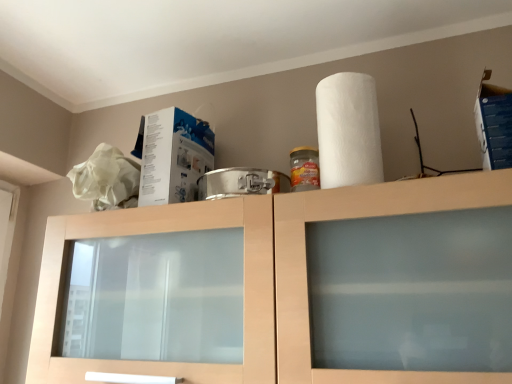
The image size is (512, 384). What do you see at coordinates (348, 131) in the screenshot?
I see `white textured paper towel at upper right` at bounding box center [348, 131].

Where is `matte wood cabinet at center`? This screenshot has width=512, height=384. matte wood cabinet at center is located at coordinates (256, 276).

Is matte wood cabinet at center in contact with white cardboard box at upper left, marked as the 2th box in a right-to-left arrangement?

No.

Can white cardboard box at upper left, the first box positioned from the back, be found inside matte wood cabinet at center?

Actually, white cardboard box at upper left, the first box positioned from the back, is outside matte wood cabinet at center.

Is point (44, 277) in front of point (183, 132)?

Yes, point (44, 277) is closer to viewer.

Does blue cardboard box at upper right, which is the 1th box from right to left, have a lesser width compared to matte wood cabinet at center?

Correct, the width of blue cardboard box at upper right, which is the 1th box from right to left, is less than that of matte wood cabinet at center.

Based on the photo, between blue cardboard box at upper right, acting as the 2th box starting from the left, and matte wood cabinet at center, which one appears on the right side from the viewer's perspective?

blue cardboard box at upper right, acting as the 2th box starting from the left, is more to the right.

From the image's perspective, is blue cardboard box at upper right, acting as the 2th box starting from the left, beneath matte wood cabinet at center?

Actually, blue cardboard box at upper right, acting as the 2th box starting from the left, appears above matte wood cabinet at center in the image.

From a real-world perspective, who is located lower, blue cardboard box at upper right, which is the first box from front to back, or matte wood cabinet at center?

matte wood cabinet at center, from a real-world perspective.

Is matte wood cabinet at center next to white textured paper towel at upper right and touching it?

No, matte wood cabinet at center is not beside white textured paper towel at upper right.

From the image's perspective, does matte wood cabinet at center appear higher than white textured paper towel at upper right?

No, from the image's perspective, matte wood cabinet at center is not over white textured paper towel at upper right.

From a real-world perspective, is matte wood cabinet at center located higher than white textured paper towel at upper right?

No.

Identify the location of paper towel on the right of matte wood cabinet at center. The image size is (512, 384). (348, 131).

Is white cardboard box at upper left, arranged as the 2th box when viewed from the front, thinner than blue cardboard box at upper right, which is the first box from front to back?

No, white cardboard box at upper left, arranged as the 2th box when viewed from the front, is not thinner than blue cardboard box at upper right, which is the first box from front to back.

In terms of height, does white cardboard box at upper left, the first box viewed from the left, look taller or shorter compared to blue cardboard box at upper right, the 2th box from the back?

In the image, white cardboard box at upper left, the first box viewed from the left, appears to be taller than blue cardboard box at upper right, the 2th box from the back.

Which is more to the right, white cardboard box at upper left, the first box positioned from the back, or blue cardboard box at upper right, the 2th box from the back?

blue cardboard box at upper right, the 2th box from the back, is more to the right.

Is point (165, 200) closer to viewer compared to point (475, 118)?

Yes, it is.

Is there a large distance between white cardboard box at upper left, marked as the 2th box in a right-to-left arrangement, and white textured paper towel at upper right?

They are positioned close to each other.

From a real-world perspective, who is located lower, white cardboard box at upper left, the first box positioned from the back, or white textured paper towel at upper right?

white cardboard box at upper left, the first box positioned from the back, from a real-world perspective.

Which is more to the left, white cardboard box at upper left, the first box positioned from the back, or white textured paper towel at upper right?

Positioned to the left is white cardboard box at upper left, the first box positioned from the back.

Considering the positions of objects white cardboard box at upper left, the first box viewed from the left, and white textured paper towel at upper right in the image provided, who is behind, white cardboard box at upper left, the first box viewed from the left, or white textured paper towel at upper right?

Positioned behind is white cardboard box at upper left, the first box viewed from the left.

From the image's perspective, is white textured paper towel at upper right located beneath white cardboard box at upper left, arranged as the 2th box when viewed from the front?

No, from the image's perspective, white textured paper towel at upper right is not below white cardboard box at upper left, arranged as the 2th box when viewed from the front.

Which is further, (369, 130) or (150, 143)?

The point (150, 143) is more distant.

Between white textured paper towel at upper right and white cardboard box at upper left, the first box viewed from the left, which one appears on the right side from the viewer's perspective?

white textured paper towel at upper right is more to the right.

Which is closer, (508, 127) or (148, 190)?

Clearly, point (508, 127) is closer to the camera than point (148, 190).

From a real-world perspective, is blue cardboard box at upper right, which is the 1th box from right to left, positioned over white cardboard box at upper left, marked as the 2th box in a right-to-left arrangement, based on gravity?

Correct, in the physical world, blue cardboard box at upper right, which is the 1th box from right to left, is higher than white cardboard box at upper left, marked as the 2th box in a right-to-left arrangement.

Is blue cardboard box at upper right, which is the 1th box from right to left, wider than white cardboard box at upper left, the first box positioned from the back?

No.

Identify the location of box on the right side of white cardboard box at upper left, the first box positioned from the back. (494, 124).

The height and width of the screenshot is (384, 512). In order to click on the 1st box above the matte wood cabinet at center (from a real-world perspective) in this screenshot , I will do `click(172, 156)`.

Where is `cabinetry to the left of blue cardboard box at upper right, acting as the 2th box starting from the left`? The width and height of the screenshot is (512, 384). cabinetry to the left of blue cardboard box at upper right, acting as the 2th box starting from the left is located at coordinates (256, 276).

Based on their spatial positions, is blue cardboard box at upper right, which is the 1th box from right to left, or matte wood cabinet at center further from white textured paper towel at upper right?

Based on the image, blue cardboard box at upper right, which is the 1th box from right to left, appears to be further to white textured paper towel at upper right.

Based on their spatial positions, is white textured paper towel at upper right or matte wood cabinet at center closer to white cardboard box at upper left, the first box positioned from the back?

matte wood cabinet at center is closer to white cardboard box at upper left, the first box positioned from the back.

Looking at this image, considering their positions, is white cardboard box at upper left, arranged as the 2th box when viewed from the front, positioned closer to matte wood cabinet at center than blue cardboard box at upper right, acting as the 2th box starting from the left?

white cardboard box at upper left, arranged as the 2th box when viewed from the front.

Estimate the real-world distances between objects in this image. Which object is closer to white textured paper towel at upper right, blue cardboard box at upper right, acting as the 2th box starting from the left, or white cardboard box at upper left, the first box viewed from the left?

Among the two, blue cardboard box at upper right, acting as the 2th box starting from the left, is located nearer to white textured paper towel at upper right.

Estimate the real-world distances between objects in this image. Which object is further from matte wood cabinet at center, blue cardboard box at upper right, acting as the 2th box starting from the left, or white textured paper towel at upper right?

blue cardboard box at upper right, acting as the 2th box starting from the left, is positioned further to the anchor matte wood cabinet at center.

From the image, which object appears to be farther from white textured paper towel at upper right, matte wood cabinet at center or white cardboard box at upper left, the first box positioned from the back?

Among the two, white cardboard box at upper left, the first box positioned from the back, is located further to white textured paper towel at upper right.

From the image, which object appears to be nearer to white cardboard box at upper left, the first box positioned from the back, blue cardboard box at upper right, which is the first box from front to back, or matte wood cabinet at center?

matte wood cabinet at center.

Which object lies further to the anchor point white cardboard box at upper left, marked as the 2th box in a right-to-left arrangement, matte wood cabinet at center or white textured paper towel at upper right?

white textured paper towel at upper right.

This screenshot has width=512, height=384. What are the coordinates of `paper towel between white cardboard box at upper left, marked as the 2th box in a right-to-left arrangement, and blue cardboard box at upper right, which is the first box from front to back` in the screenshot? It's located at (348, 131).

Locate an element on the screen. cabinetry between white cardboard box at upper left, marked as the 2th box in a right-to-left arrangement, and white textured paper towel at upper right, in the horizontal direction is located at coordinates tap(256, 276).

In order to click on cabinetry between white cardboard box at upper left, the first box viewed from the left, and blue cardboard box at upper right, which is the first box from front to back in this screenshot , I will do `click(256, 276)`.

Find the location of a particular element. This screenshot has width=512, height=384. paper towel between matte wood cabinet at center and blue cardboard box at upper right, acting as the 2th box starting from the left, from left to right is located at coordinates (348, 131).